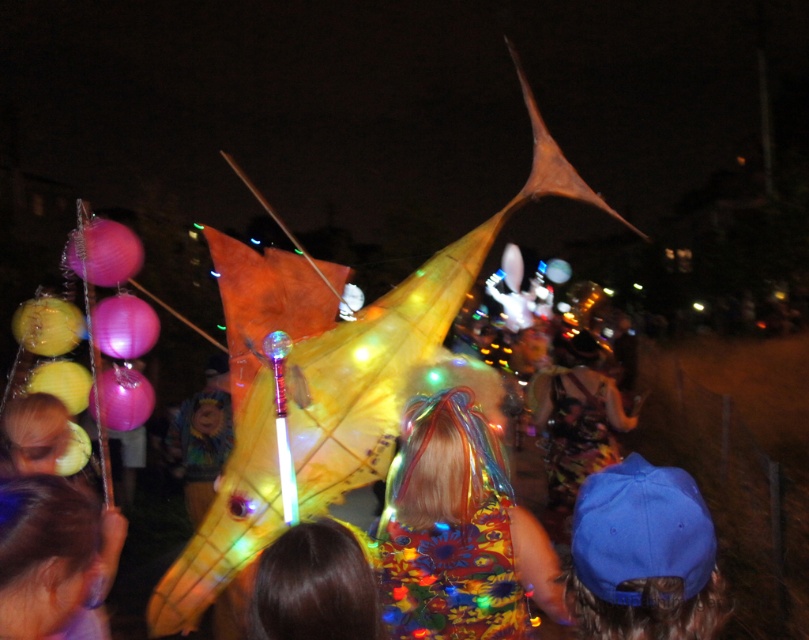
Question: From the image, what is the correct spatial relationship of floral fabric dress at center in relation to blue fabric cap at center?

Choices:
 (A) above
 (B) below

Answer: (A)

Question: Which object is farther from the camera taking this photo?

Choices:
 (A) floral fabric dress at center
 (B) blue fabric cap at center

Answer: (A)

Question: Can you confirm if blue fabric cap at center is positioned to the right of blonde hair at center?

Choices:
 (A) no
 (B) yes

Answer: (B)

Question: Which point is closer to the camera?

Choices:
 (A) blonde hair at center
 (B) floral dress at center
 (C) brown hair at center

Answer: (A)

Question: Is floral fabric dress at center bigger than floral dress at center?

Choices:
 (A) yes
 (B) no

Answer: (B)

Question: Which object is positioned farthest from the floral dress at center?

Choices:
 (A) blonde hair at center
 (B) floral fabric dress at center
 (C) brown hair at center

Answer: (A)